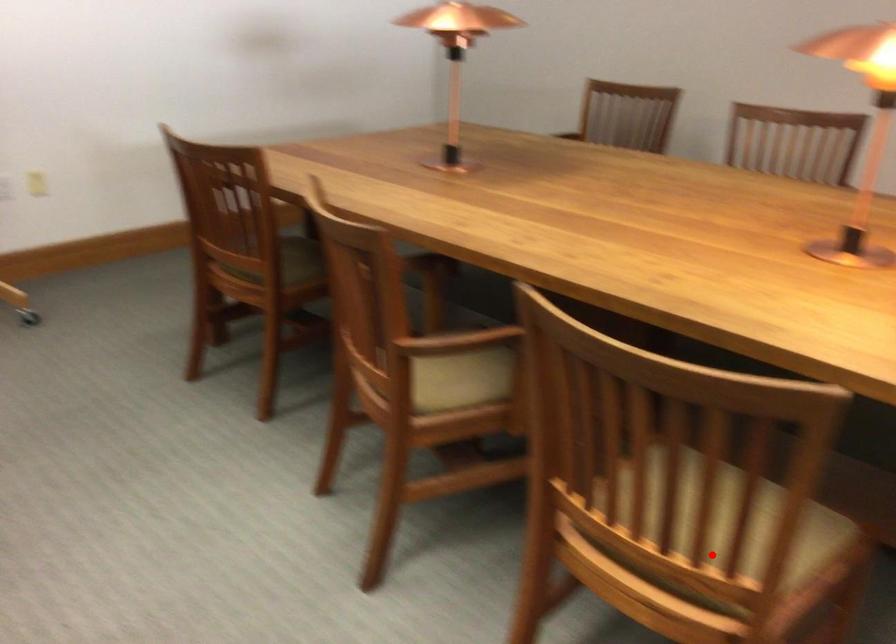
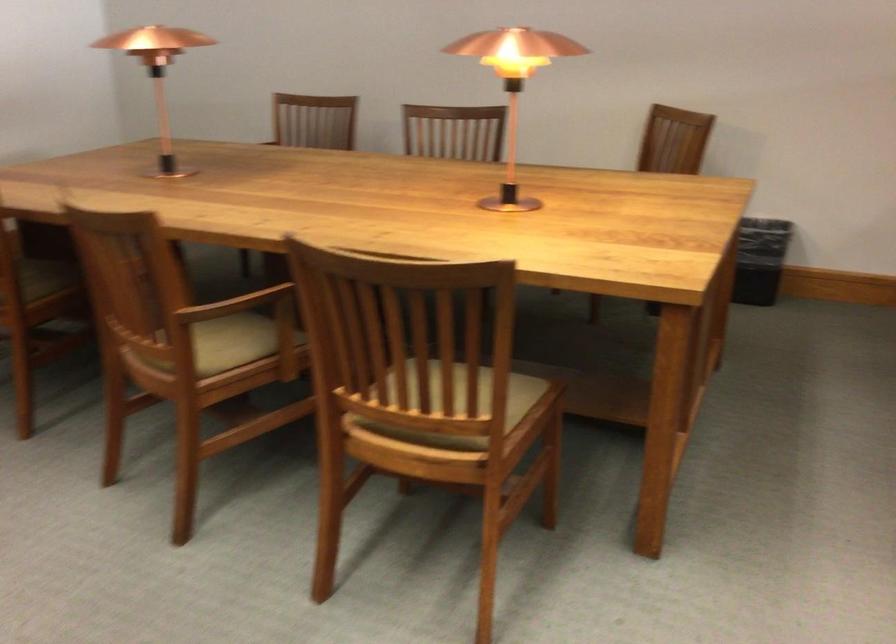
Question: I am providing you with two images of the same scene from different viewpoints. Image1 has a red point marked. In image2, the corresponding 3D location appears at what relative position? Reply with the corresponding letter.

Choices:
 (A) Closer
 (B) Farther

Answer: (B)